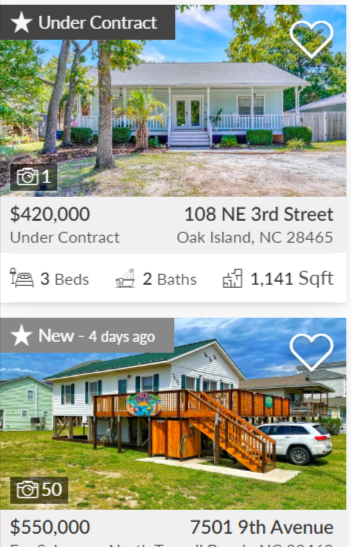
Find the location of `hand railing`. hand railing is located at coordinates (169, 128), (227, 417).